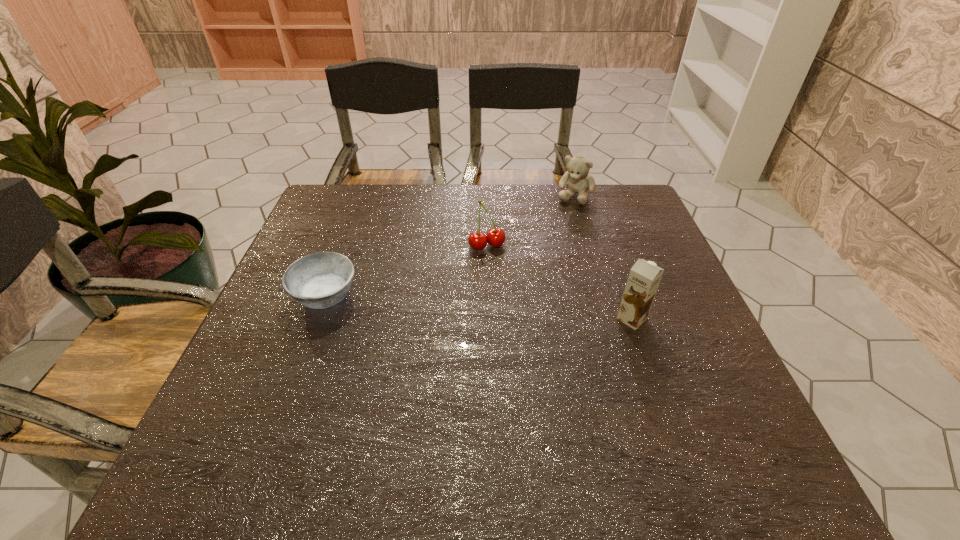
Identify the location of vacant area that lies between the leftmost object and the tallest object. (479, 307).

Image resolution: width=960 pixels, height=540 pixels. What are the coordinates of `vacant space that is in between the chocolate milk and the farthest object` in the screenshot? It's located at 603,257.

This screenshot has width=960, height=540. In order to click on free space between the shortest object and the tallest object in this screenshot , I will do pos(479,307).

This screenshot has width=960, height=540. What are the coordinates of `free space between the teddy bear and the shortest object` in the screenshot? It's located at (450, 246).

Locate an element on the screen. The image size is (960, 540). empty space between the farthest object and the tallest object is located at coordinates (603, 257).

Identify the location of vacant space that is in between the teddy bear and the chocolate milk. Image resolution: width=960 pixels, height=540 pixels. (603, 257).

Point out which object is positioned as the third nearest to the second object from left to right. Please provide its 2D coordinates. Your answer should be formatted as a tuple, i.e. [(x, y)], where the tuple contains the x and y coordinates of a point satisfying the conditions above.

[(644, 277)]

Identify which object is located as the nearest to the ashtray. Please provide its 2D coordinates. Your answer should be formatted as a tuple, i.e. [(x, y)], where the tuple contains the x and y coordinates of a point satisfying the conditions above.

[(495, 237)]

Image resolution: width=960 pixels, height=540 pixels. I want to click on blank area in the image that satisfies the following two spatial constraints: 1. on the back side of the farthest object; 2. on the right side of the third object from right to left, so click(x=486, y=195).

Where is `free point that satisfies the following two spatial constraints: 1. on the front side of the second object from left to right; 2. on the right side of the chocolate milk`? free point that satisfies the following two spatial constraints: 1. on the front side of the second object from left to right; 2. on the right side of the chocolate milk is located at coordinates (488, 319).